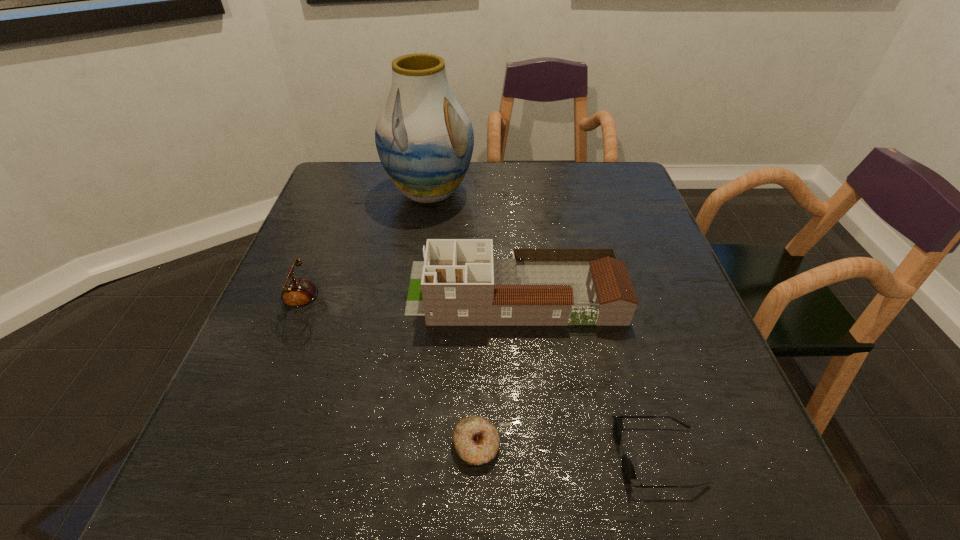
The image size is (960, 540). What are the coordinates of `dollhouse that is positioned at the right edge` in the screenshot? It's located at (459, 283).

At what (x,y) coordinates should I click in order to perform the action: click on sunglasses at the right edge. Please return your answer as a coordinate pair (x, y). The height and width of the screenshot is (540, 960). Looking at the image, I should click on (628, 470).

Locate an element on the screen. This screenshot has height=540, width=960. object positioned at the near right corner is located at coordinates (628, 470).

In the image, there is a desktop. At what (x,y) coordinates should I click in order to perform the action: click on vacant area at the far edge. Please return your answer as a coordinate pair (x, y). Looking at the image, I should click on (498, 198).

Image resolution: width=960 pixels, height=540 pixels. What are the coordinates of `vacant area at the near edge of the desktop` in the screenshot? It's located at (467, 491).

In order to click on free space at the left edge in this screenshot , I will do `click(355, 231)`.

The height and width of the screenshot is (540, 960). Find the location of `free location at the right edge`. free location at the right edge is located at coordinates (732, 424).

At what (x,y) coordinates should I click in order to perform the action: click on vacant space at the far left corner of the desktop. Please return your answer as a coordinate pair (x, y). The width and height of the screenshot is (960, 540). Looking at the image, I should click on (376, 178).

Where is `free point between the vase and the telephone`? The image size is (960, 540). free point between the vase and the telephone is located at coordinates (365, 252).

You are a GUI agent. You are given a task and a screenshot of the screen. Output one action in this format:
    pyautogui.click(x=<x>, y=<y>)
    Task: Click on the vacant space that's between the sunglasses and the doughnut
    The width and height of the screenshot is (960, 540).
    Given the screenshot: What is the action you would take?
    pyautogui.click(x=567, y=450)